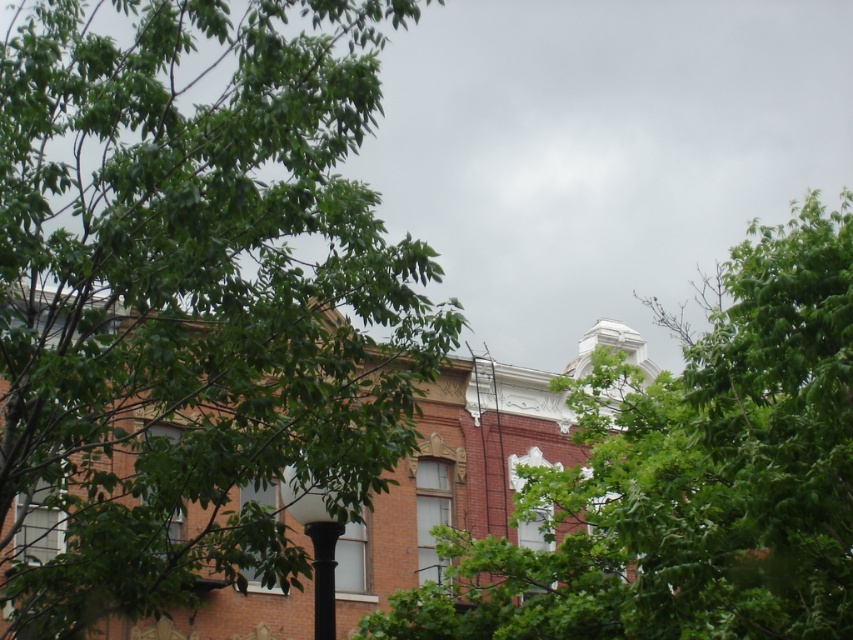
Which of these two, green leafy tree at upper left or green leafy tree at upper center, stands taller?

Standing taller between the two is green leafy tree at upper left.

Is green leafy tree at upper left to the left of green leafy tree at upper center from the viewer's perspective?

Correct, you'll find green leafy tree at upper left to the left of green leafy tree at upper center.

Who is more forward, [119,280] or [558,520]?

Point [119,280] is in front.

The width and height of the screenshot is (853, 640). Find the location of `green leafy tree at upper left`. green leafy tree at upper left is located at coordinates (190, 298).